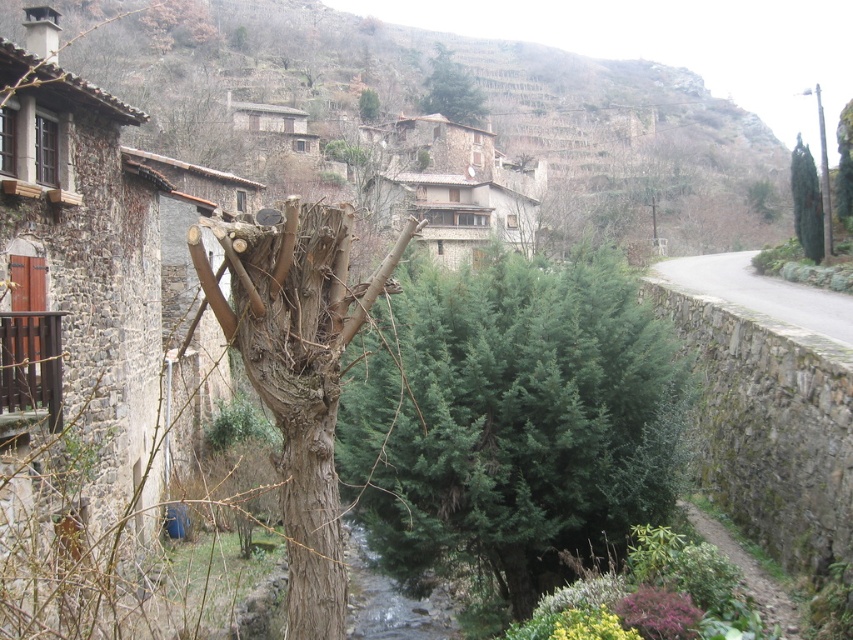
Is gray stone wall at right shorter than green textured tree at center?

Yes.

Does point (846, 298) lie in front of point (378, 113)?

Yes, it is in front of point (378, 113).

Between point (844, 308) and point (369, 99), which one is positioned behind?

Point (369, 99)

Where is `gray stone wall at right`? gray stone wall at right is located at coordinates (759, 292).

Is gray stone wall at right positioned at the back of green textured tree at right?

No, it is in front of green textured tree at right.

Image resolution: width=853 pixels, height=640 pixels. What are the coordinates of `gray stone wall at right` in the screenshot? It's located at point(759,292).

Is point (827, 301) in front of point (796, 188)?

Yes.

Locate an element on the screen. This screenshot has height=640, width=853. gray stone wall at right is located at coordinates coord(759,292).

Where is `green needle-like at center`? The height and width of the screenshot is (640, 853). green needle-like at center is located at coordinates (512, 420).

Is green needle-like at center further to the viewer compared to green textured tree at right?

No.

The width and height of the screenshot is (853, 640). What do you see at coordinates (512, 420) in the screenshot? I see `green needle-like at center` at bounding box center [512, 420].

What are the coordinates of `green needle-like at center` in the screenshot? It's located at (512, 420).